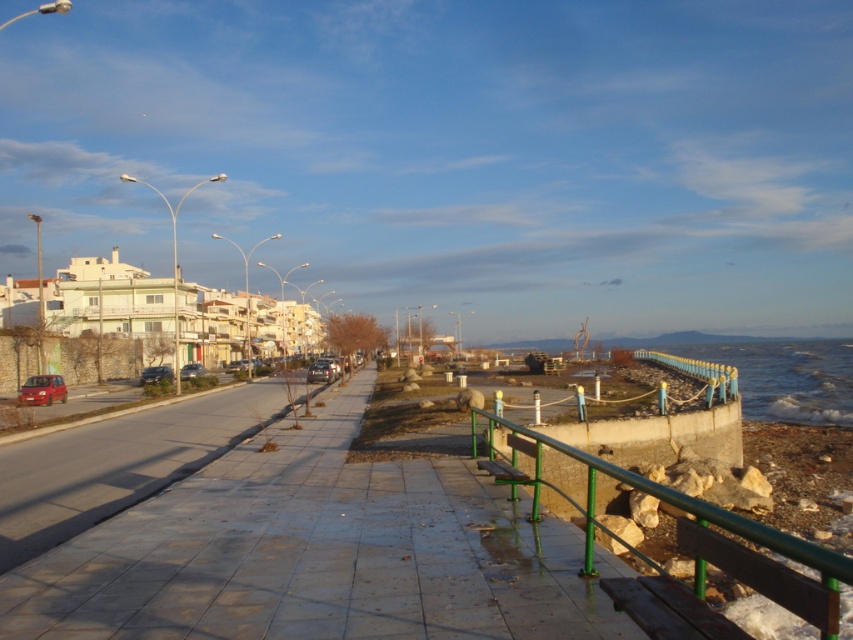
You are a delivery person needing to park your vehicle, which is the same size as the metallic silver car at center. There is a parking spot next to the green metallic railing at lower right. Will your car fit in that spot?

The green metallic railing at lower right has a larger size compared to the metallic silver car at center. Since your car is the same size as the metallic silver car at center, it should fit in the parking spot next to the green metallic railing at lower right as the railing is larger and likely provides sufficient space.

You are a delivery person who needs to park your metallic silver car at center on the smooth concrete pavement at center. Can your car fit on the pavement?

The smooth concrete pavement at center has a larger size compared to metallic silver car at center, so yes, the metallic silver car at center can fit on the smooth concrete pavement at center.